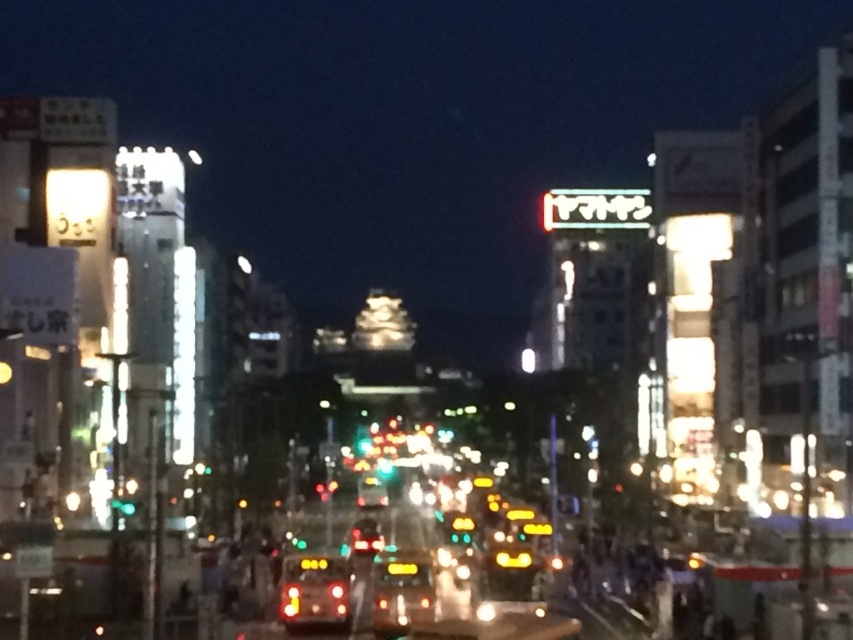
Question: Which of the following is the farthest from the observer?

Choices:
 (A) (277, 604)
 (B) (432, 609)

Answer: (A)

Question: Is matte yellow taxi at center above yellow reflective taxi at center?

Choices:
 (A) no
 (B) yes

Answer: (B)

Question: Which point is closer to the camera?

Choices:
 (A) (300, 586)
 (B) (412, 605)

Answer: (A)

Question: Is matte yellow taxi at center thinner than yellow reflective taxi at center?

Choices:
 (A) no
 (B) yes

Answer: (A)

Question: Does matte yellow taxi at center appear over yellow reflective taxi at center?

Choices:
 (A) no
 (B) yes

Answer: (B)